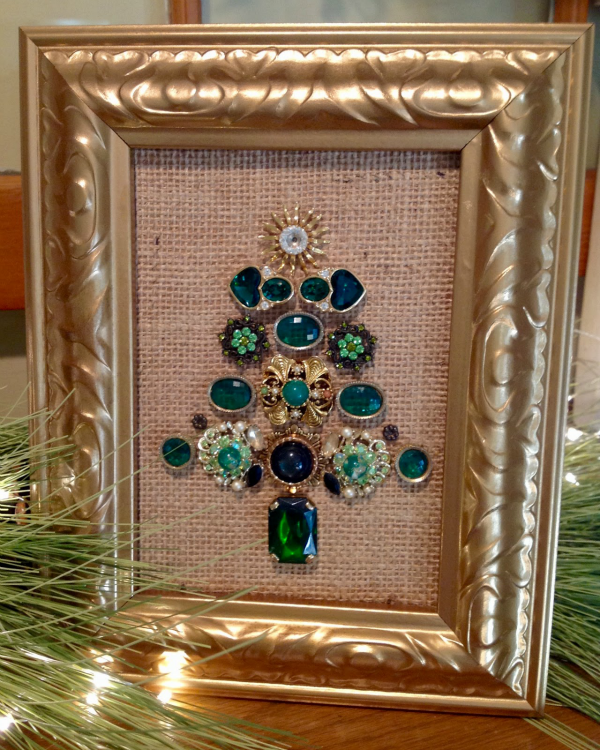
What are the coordinates of `sun shaped gold and silver decoration / piece of jewelry` in the screenshot? It's located at (305, 225).